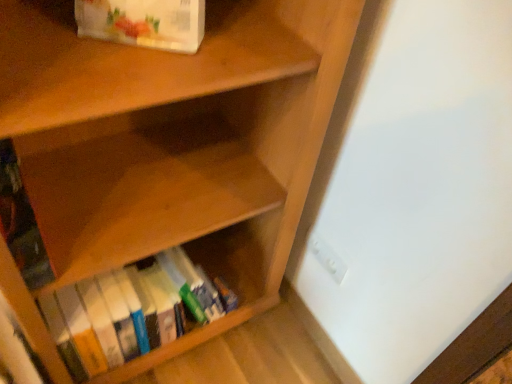
What do you see at coordinates (144, 22) in the screenshot? I see `white paper bag at upper left, acting as the 3th book starting from the bottom` at bounding box center [144, 22].

What is the approximate height of hardcover books at lower center, arranged as the third book when viewed from the top?

It is 24.29 centimeters.

What is the approximate width of white plastic electric outlet at lower right?

1.11 inches.

Where is `white plastic electric outlet at lower right`? Image resolution: width=512 pixels, height=384 pixels. white plastic electric outlet at lower right is located at coordinates (327, 258).

At what (x,y) coordinates should I click in order to perform the action: click on white paper bag at upper left, acting as the 3th book starting from the bottom. Please return your answer as a coordinate pair (x, y). Looking at the image, I should click on (144, 22).

Is point (146, 266) behind point (331, 269)?

That is True.

In the scene shown: Is hardcover books at lower center, arranged as the third book when viewed from the top, not near white plastic electric outlet at lower right?

hardcover books at lower center, arranged as the third book when viewed from the top, is near white plastic electric outlet at lower right, not far away.

Based on the photo, from the image's perspective, is hardcover books at lower center, arranged as the first book when ordered from the bottom, located above white plastic electric outlet at lower right?

No, from the image's perspective, hardcover books at lower center, arranged as the first book when ordered from the bottom, is not on top of white plastic electric outlet at lower right.

From a real-world perspective, is hardcover books at lower center, arranged as the third book when viewed from the top, beneath white plastic electric outlet at lower right?

Yes, from a real-world perspective, hardcover books at lower center, arranged as the third book when viewed from the top, is beneath white plastic electric outlet at lower right.

Is the position of white plastic electric outlet at lower right less distant than that of white paper bag at upper left, acting as the 3th book starting from the bottom?

No, white plastic electric outlet at lower right is behind white paper bag at upper left, acting as the 3th book starting from the bottom.

Can you confirm if white plastic electric outlet at lower right is positioned to the left of white paper bag at upper left, acting as the 3th book starting from the bottom?

No, white plastic electric outlet at lower right is not to the left of white paper bag at upper left, acting as the 3th book starting from the bottom.

From the picture: In terms of width, does white plastic electric outlet at lower right look wider or thinner when compared to white paper bag at upper left, acting as the 3th book starting from the bottom?

Clearly, white plastic electric outlet at lower right has less width compared to white paper bag at upper left, acting as the 3th book starting from the bottom.

Is hardcover books at lower center, arranged as the first book when ordered from the bottom, next to white paper bag at upper left, acting as the 3th book starting from the bottom, and touching it?

No, hardcover books at lower center, arranged as the first book when ordered from the bottom, is not beside white paper bag at upper left, acting as the 3th book starting from the bottom.

Is hardcover books at lower center, arranged as the first book when ordered from the bottom, positioned with its back to white paper bag at upper left, acting as the 3th book starting from the bottom?

No, hardcover books at lower center, arranged as the first book when ordered from the bottom,'s orientation is not away from white paper bag at upper left, acting as the 3th book starting from the bottom.

Which point is more forward, (189, 285) or (100, 35)?

Positioned in front is point (100, 35).

Is hardcover books at lower center, arranged as the first book when ordered from the bottom, inside or outside of white paper bag at upper left, acting as the 3th book starting from the bottom?

hardcover books at lower center, arranged as the first book when ordered from the bottom, is outside white paper bag at upper left, acting as the 3th book starting from the bottom.

Which is more to the left, hardcover book at left, the second book ordered from the bottom, or white plastic electric outlet at lower right?

From the viewer's perspective, hardcover book at left, the second book ordered from the bottom, appears more on the left side.

Is point (46, 256) less distant than point (311, 240)?

Yes.

Would you say hardcover book at left, positioned as the 2th book in top-to-bottom order, is inside or outside white plastic electric outlet at lower right?

The correct answer is: outside.

Based on the photo, would you consider hardcover book at left, the second book ordered from the bottom, to be distant from white plastic electric outlet at lower right?

No, there isn't a large distance between hardcover book at left, the second book ordered from the bottom, and white plastic electric outlet at lower right.

From the picture: Considering the sizes of objects white plastic electric outlet at lower right and hardcover books at lower center, arranged as the first book when ordered from the bottom, in the image provided, who is wider, white plastic electric outlet at lower right or hardcover books at lower center, arranged as the first book when ordered from the bottom,?

With larger width is hardcover books at lower center, arranged as the first book when ordered from the bottom.

Relative to hardcover books at lower center, arranged as the first book when ordered from the bottom, is white plastic electric outlet at lower right in front or behind?

white plastic electric outlet at lower right is behind hardcover books at lower center, arranged as the first book when ordered from the bottom.

Which object is positioned more to the left, white plastic electric outlet at lower right or hardcover books at lower center, arranged as the first book when ordered from the bottom?

From the viewer's perspective, hardcover books at lower center, arranged as the first book when ordered from the bottom, appears more on the left side.

Is white plastic electric outlet at lower right turned away from hardcover books at lower center, arranged as the first book when ordered from the bottom?

white plastic electric outlet at lower right is not turned away from hardcover books at lower center, arranged as the first book when ordered from the bottom.

Is white paper bag at upper left, acting as the 3th book starting from the bottom, facing towards hardcover book at left, positioned as the 2th book in top-to-bottom order?

No.

From a real-world perspective, is white paper bag at upper left, acting as the 3th book starting from the bottom, beneath hardcover book at left, positioned as the 2th book in top-to-bottom order?

No.

Where is `the 1st book positioned below the white paper bag at upper left, acting as the 3th book starting from the bottom (from a real-world perspective)`? The height and width of the screenshot is (384, 512). the 1st book positioned below the white paper bag at upper left, acting as the 3th book starting from the bottom (from a real-world perspective) is located at coordinates pyautogui.click(x=21, y=223).

Is hardcover book at left, the second book ordered from the bottom, positioned with its back to white paper bag at upper left, which is the first book in top-to-bottom order?

That's not correct — hardcover book at left, the second book ordered from the bottom, is not looking away from white paper bag at upper left, which is the first book in top-to-bottom order.

Between hardcover book at left, positioned as the 2th book in top-to-bottom order, and white paper bag at upper left, which is the first book in top-to-bottom order, which one has larger size?

white paper bag at upper left, which is the first book in top-to-bottom order, is bigger.

Looking at this image, from the image's perspective, is hardcover book at left, the second book ordered from the bottom, beneath white paper bag at upper left, acting as the 3th book starting from the bottom?

Yes, from the image's perspective, hardcover book at left, the second book ordered from the bottom, is beneath white paper bag at upper left, acting as the 3th book starting from the bottom.

Identify the location of the 1st book below when counting from the white paper bag at upper left, which is the first book in top-to-bottom order (from the image's perspective). The image size is (512, 384). (21, 223).

What are the coordinates of `electric outlet that is above the hardcover books at lower center, arranged as the third book when viewed from the top (from the image's perspective)` in the screenshot? It's located at (327, 258).

Image resolution: width=512 pixels, height=384 pixels. Find the location of `book that is the 3rd one when counting forward from the white plastic electric outlet at lower right`. book that is the 3rd one when counting forward from the white plastic electric outlet at lower right is located at coordinates (144, 22).

Looking at the image, which one is located closer to white paper bag at upper left, acting as the 3th book starting from the bottom, white plastic electric outlet at lower right or hardcover books at lower center, arranged as the third book when viewed from the top?

The object closer to white paper bag at upper left, acting as the 3th book starting from the bottom, is hardcover books at lower center, arranged as the third book when viewed from the top.

Which object lies nearer to the anchor point white plastic electric outlet at lower right, white paper bag at upper left, which is the first book in top-to-bottom order, or hardcover book at left, positioned as the 2th book in top-to-bottom order?

Based on the image, white paper bag at upper left, which is the first book in top-to-bottom order, appears to be nearer to white plastic electric outlet at lower right.

Based on their spatial positions, is hardcover books at lower center, arranged as the third book when viewed from the top, or white plastic electric outlet at lower right further from hardcover book at left, the second book ordered from the bottom?

white plastic electric outlet at lower right lies further to hardcover book at left, the second book ordered from the bottom, than the other object.

Considering their positions, is hardcover book at left, positioned as the 2th book in top-to-bottom order, positioned closer to white paper bag at upper left, which is the first book in top-to-bottom order, than white plastic electric outlet at lower right?

hardcover book at left, positioned as the 2th book in top-to-bottom order, is positioned closer to the anchor white paper bag at upper left, which is the first book in top-to-bottom order.

Looking at the image, which one is located closer to white plastic electric outlet at lower right, hardcover book at left, positioned as the 2th book in top-to-bottom order, or hardcover books at lower center, arranged as the first book when ordered from the bottom?

The object closer to white plastic electric outlet at lower right is hardcover books at lower center, arranged as the first book when ordered from the bottom.

Which object lies further to the anchor point hardcover books at lower center, arranged as the third book when viewed from the top, hardcover book at left, the second book ordered from the bottom, or white paper bag at upper left, which is the first book in top-to-bottom order?

Based on the image, white paper bag at upper left, which is the first book in top-to-bottom order, appears to be further to hardcover books at lower center, arranged as the third book when viewed from the top.

Considering their positions, is white plastic electric outlet at lower right positioned closer to hardcover books at lower center, arranged as the third book when viewed from the top, than hardcover book at left, the second book ordered from the bottom?

The object closer to hardcover books at lower center, arranged as the third book when viewed from the top, is hardcover book at left, the second book ordered from the bottom.

Estimate the real-world distances between objects in this image. Which object is closer to white plastic electric outlet at lower right, hardcover books at lower center, arranged as the third book when viewed from the top, or white paper bag at upper left, which is the first book in top-to-bottom order?

hardcover books at lower center, arranged as the third book when viewed from the top, lies closer to white plastic electric outlet at lower right than the other object.

The height and width of the screenshot is (384, 512). In order to click on book between white paper bag at upper left, which is the first book in top-to-bottom order, and hardcover books at lower center, arranged as the first book when ordered from the bottom, from top to bottom in this screenshot , I will do `click(21, 223)`.

You are a GUI agent. You are given a task and a screenshot of the screen. Output one action in this format:
    pyautogui.click(x=<x>, y=<y>)
    Task: Click on the electric outlet between white paper bag at upper left, acting as the 3th book starting from the bottom, and hardcover books at lower center, arranged as the third book when viewed from the top, in the vertical direction
    This screenshot has width=512, height=384.
    Given the screenshot: What is the action you would take?
    pyautogui.click(x=327, y=258)